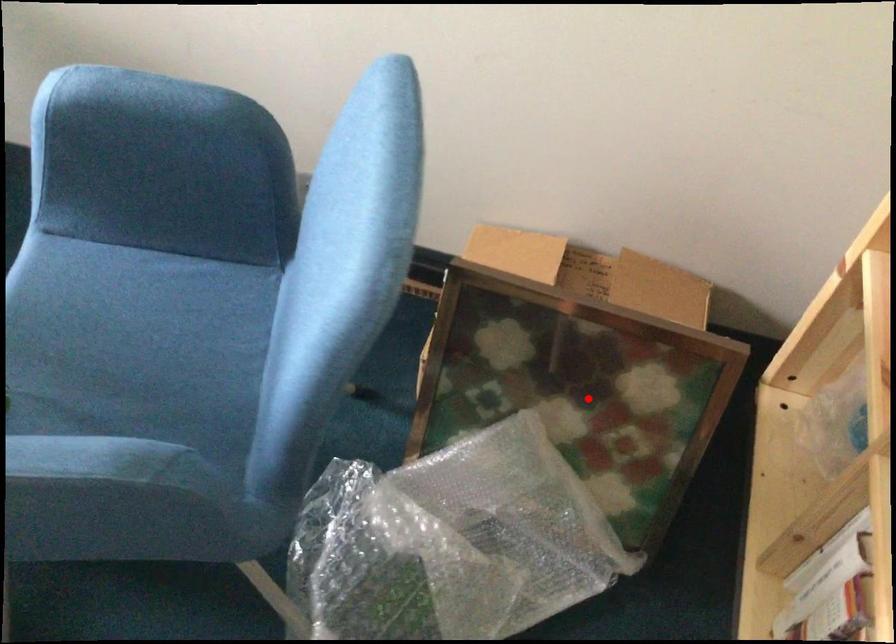
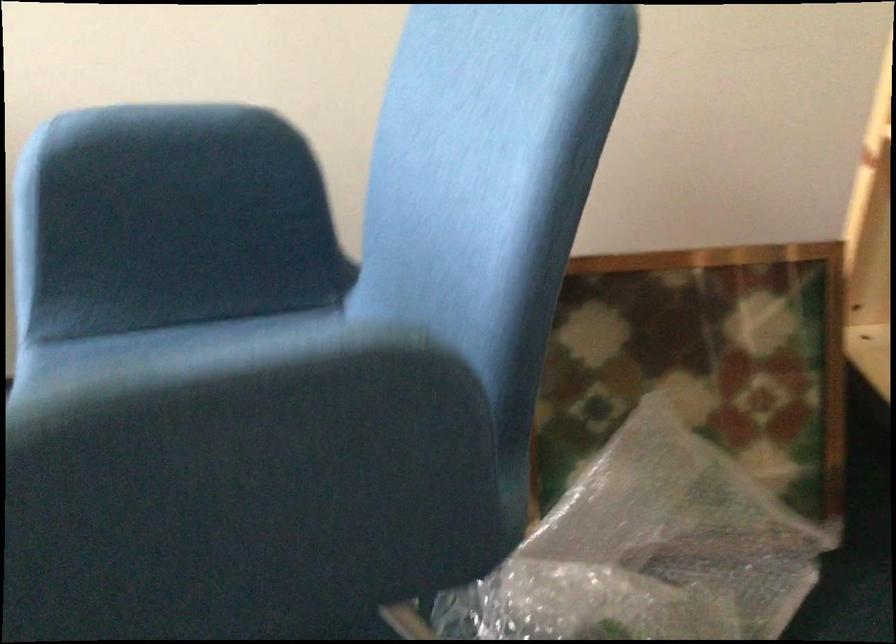
Question: A red point is marked in image1. In image2, is the corresponding 3D point closer to the camera or farther? Reply with the corresponding letter.

Choices:
 (A) The corresponding 3D point is closer.
 (B) The corresponding 3D point is farther.

Answer: (A)